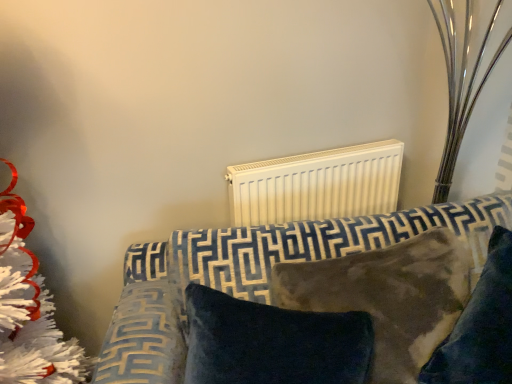
Question: Could you tell me if velvet-patterned sofa at center is facing velvet dark blue pillow at center, marked as the 2th pillow in a right-to-left arrangement?

Choices:
 (A) no
 (B) yes

Answer: (B)

Question: Would you say velvet-patterned sofa at center is a long distance from velvet dark blue pillow at center, marked as the 2th pillow in a right-to-left arrangement?

Choices:
 (A) no
 (B) yes

Answer: (A)

Question: Is velvet-patterned sofa at center smaller than velvet dark blue pillow at center, positioned as the 1th pillow in left-to-right order?

Choices:
 (A) yes
 (B) no

Answer: (B)

Question: Does velvet-patterned sofa at center appear on the left side of velvet dark blue pillow at center, positioned as the 1th pillow in left-to-right order?

Choices:
 (A) yes
 (B) no

Answer: (B)

Question: Considering the relative sizes of velvet-patterned sofa at center and velvet dark blue pillow at center, positioned as the 1th pillow in left-to-right order, in the image provided, is velvet-patterned sofa at center wider than velvet dark blue pillow at center, positioned as the 1th pillow in left-to-right order,?

Choices:
 (A) no
 (B) yes

Answer: (B)

Question: Is velvet-patterned sofa at center inside or outside of velvety brown pillow at center, the second pillow in the left-to-right sequence?

Choices:
 (A) inside
 (B) outside

Answer: (B)

Question: In the image, is velvet-patterned sofa at center positioned in front of or behind velvety brown pillow at center, which appears as the first pillow when viewed from the right?

Choices:
 (A) front
 (B) behind

Answer: (A)

Question: Based on their sizes in the image, would you say velvet-patterned sofa at center is bigger or smaller than velvety brown pillow at center, the second pillow in the left-to-right sequence?

Choices:
 (A) big
 (B) small

Answer: (A)

Question: In terms of width, does velvet-patterned sofa at center look wider or thinner when compared to velvety brown pillow at center, which appears as the first pillow when viewed from the right?

Choices:
 (A) wide
 (B) thin

Answer: (A)

Question: In terms of size, does velvet dark blue pillow at center, positioned as the 1th pillow in left-to-right order, appear bigger or smaller than velvety brown pillow at center, which appears as the first pillow when viewed from the right?

Choices:
 (A) big
 (B) small

Answer: (B)

Question: Considering the positions of velvet dark blue pillow at center, positioned as the 1th pillow in left-to-right order, and velvety brown pillow at center, the second pillow in the left-to-right sequence, in the image, is velvet dark blue pillow at center, positioned as the 1th pillow in left-to-right order, taller or shorter than velvety brown pillow at center, the second pillow in the left-to-right sequence,?

Choices:
 (A) tall
 (B) short

Answer: (B)

Question: Looking at their shapes, would you say velvet dark blue pillow at center, positioned as the 1th pillow in left-to-right order, is wider or thinner than velvety brown pillow at center, which appears as the first pillow when viewed from the right?

Choices:
 (A) wide
 (B) thin

Answer: (B)

Question: From a real-world perspective, is velvet dark blue pillow at center, positioned as the 1th pillow in left-to-right order, above or below velvety brown pillow at center, which appears as the first pillow when viewed from the right?

Choices:
 (A) above
 (B) below

Answer: (B)

Question: Is point click(454, 377) closer or farther from the camera than point click(369, 339)?

Choices:
 (A) farther
 (B) closer

Answer: (B)

Question: Based on their positions, is velvety brown pillow at center, the second pillow in the left-to-right sequence, located to the left or right of velvet dark blue pillow at center, marked as the 2th pillow in a right-to-left arrangement?

Choices:
 (A) right
 (B) left

Answer: (A)